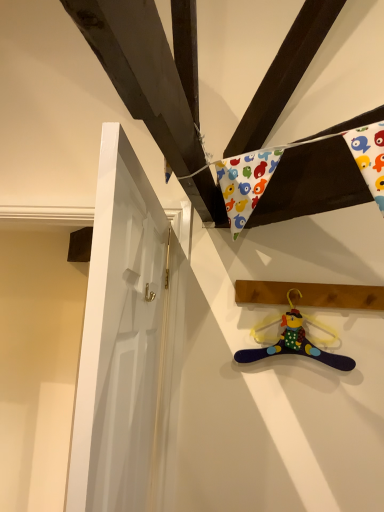
This screenshot has width=384, height=512. Find the location of `empty space that is ontop of wooden plank at upper right (from a real-world perspective)`. empty space that is ontop of wooden plank at upper right (from a real-world perspective) is located at coordinates (299, 277).